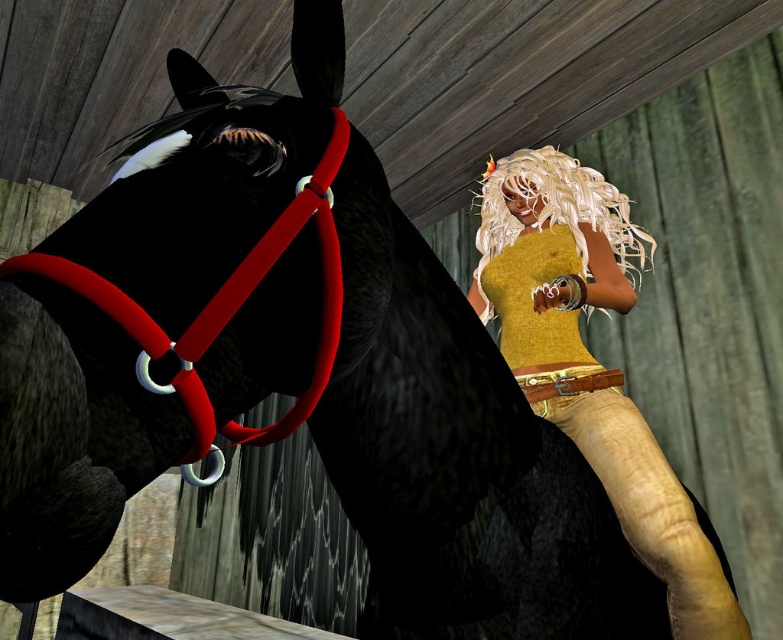
In the scene shown: Who is higher up, matte yellow tank top at center or blonde hair wig at upper right?

blonde hair wig at upper right is above.

Measure the distance between matte yellow tank top at center and camera.

matte yellow tank top at center and camera are 1.22 meters apart from each other.

Who is more distant from viewer, [500,209] or [608,184]?

The point [608,184] is more distant.

What are the coordinates of `matte yellow tank top at center` in the screenshot? It's located at (590, 362).